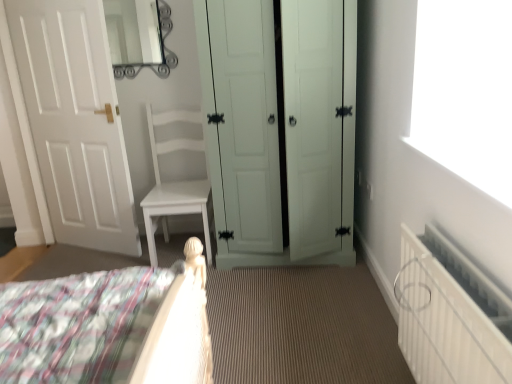
Question: From a real-world perspective, is metallic silver mirror at upper center physically located above or below light green wood wardrobe at center, the first door in the right-to-left sequence?

Choices:
 (A) above
 (B) below

Answer: (A)

Question: From the image's perspective, is metallic silver mirror at upper center positioned above or below light green wood wardrobe at center, the first door in the right-to-left sequence?

Choices:
 (A) below
 (B) above

Answer: (B)

Question: Which is farther from the metallic silver mirror at upper center?

Choices:
 (A) white textured radiator at lower right
 (B) white matte door at left, acting as the 2th door starting from the right
 (C) light green wood wardrobe at center, the first door in the right-to-left sequence

Answer: (A)

Question: Based on their relative distances, which object is farther from the white textured radiator at lower right?

Choices:
 (A) metallic silver mirror at upper center
 (B) light green wood wardrobe at center, the first door in the right-to-left sequence
 (C) white matte door at left, which is counted as the 1th door, starting from the left

Answer: (A)